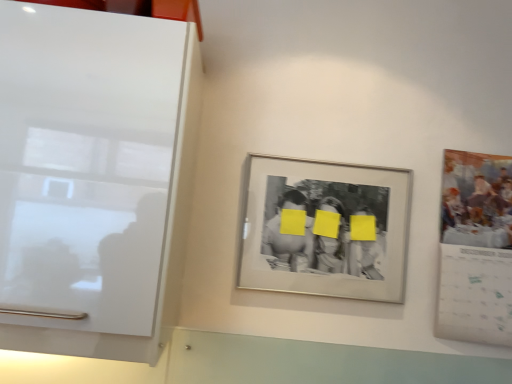
Question: Is white glossy cabinet at left inside or outside of silver/metallic photo frame at center?

Choices:
 (A) outside
 (B) inside

Answer: (A)

Question: Is white glossy cabinet at left in front of or behind silver/metallic photo frame at center in the image?

Choices:
 (A) behind
 (B) front

Answer: (B)

Question: From the image's perspective, is white glossy cabinet at left above or below silver/metallic photo frame at center?

Choices:
 (A) below
 (B) above

Answer: (B)

Question: Does point (324, 206) appear closer or farther from the camera than point (181, 218)?

Choices:
 (A) closer
 (B) farther

Answer: (B)

Question: Is silver/metallic photo frame at center taller or shorter than white glossy cabinet at left?

Choices:
 (A) short
 (B) tall

Answer: (A)

Question: From the image's perspective, is silver/metallic photo frame at center located above or below white glossy cabinet at left?

Choices:
 (A) below
 (B) above

Answer: (A)

Question: Is silver/metallic photo frame at center inside the boundaries of white glossy cabinet at left, or outside?

Choices:
 (A) outside
 (B) inside

Answer: (A)